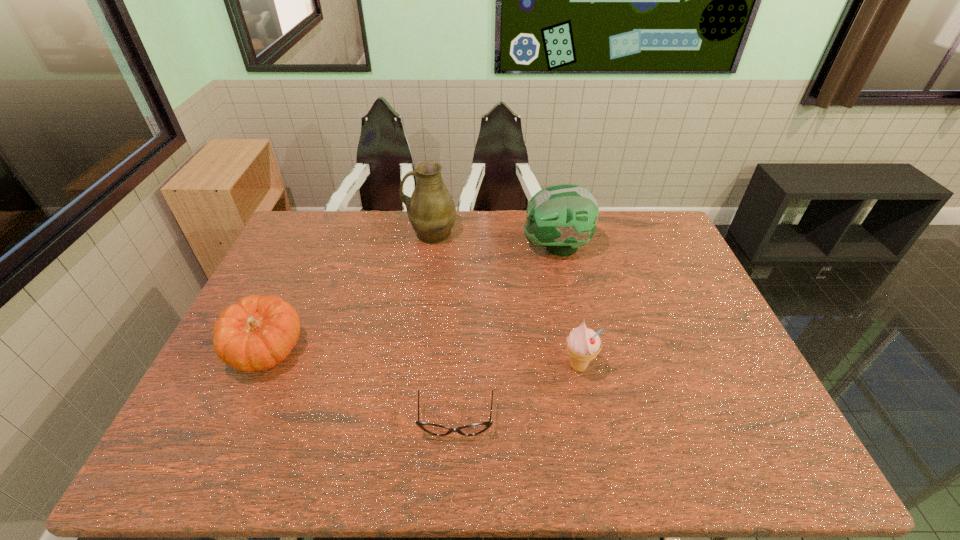
Where is `vacant space positioned on the visor of the football helmet`? The image size is (960, 540). vacant space positioned on the visor of the football helmet is located at coordinates (423, 247).

Identify the location of vacant space situated 0.280m on the visor of the football helmet. (441, 247).

Find the location of a particular element. free location located 0.230m on the front of the icecream is located at coordinates (599, 471).

The image size is (960, 540). I want to click on vacant space situated 0.380m on the back of the leftmost object, so click(x=317, y=241).

Find the location of a particular element. free space located 0.060m on the front-facing side of the shortest object is located at coordinates (454, 467).

Where is `pitcher that is positioned at the far edge`? pitcher that is positioned at the far edge is located at coordinates [x=431, y=210].

This screenshot has width=960, height=540. Find the location of `football helmet positioned at the far edge`. football helmet positioned at the far edge is located at coordinates (563, 217).

This screenshot has height=540, width=960. Identify the location of object located at the near edge. (473, 429).

Locate an element on the screen. The height and width of the screenshot is (540, 960). object that is at the left edge is located at coordinates (258, 332).

You are a GUI agent. You are given a task and a screenshot of the screen. Output one action in this format:
    pyautogui.click(x=<x>, y=<y>)
    Task: Click on the free region at the far edge
    This screenshot has height=540, width=960.
    Given the screenshot: What is the action you would take?
    pyautogui.click(x=334, y=236)